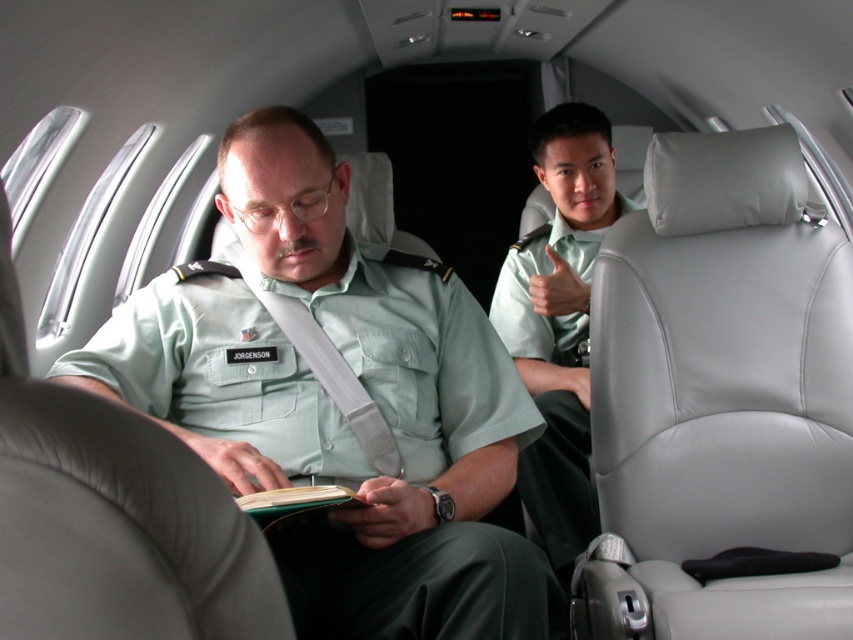
You are a passenger on the private jet and want to locate the green uniform at center. Which object in the cabin corresponds to the coordinates point (339, 403)?

The point (339, 403) corresponds to the green uniform at center.

You are a passenger in the private jet cabin and want to reach the overhead panel to adjust the lights. You are currently standing at point (409, 484). Which direction should you move relative to point (554, 397) to get closer to the overhead panel?

Since point (409, 484) is in front of point (554, 397), you should move backward towards point (554, 397) to reach the overhead panel.

Consider the image. You are a passenger on this private jet and want to place a 10 cm wide item on the seat next to you. The seat has a width of 12 cm. There is a light green fabric shirt at center and a green matte book at center nearby. Which object can you place on the seat without exceeding its width?

The light green fabric shirt at center has a width surpassing the green matte book at center. Since the seat is 12 cm wide, the green matte book at center, being narrower, can fit within the 12 cm width. The light green fabric shirt at center is wider and would exceed the seat width. Therefore, you should place the green matte book at center on the seat.